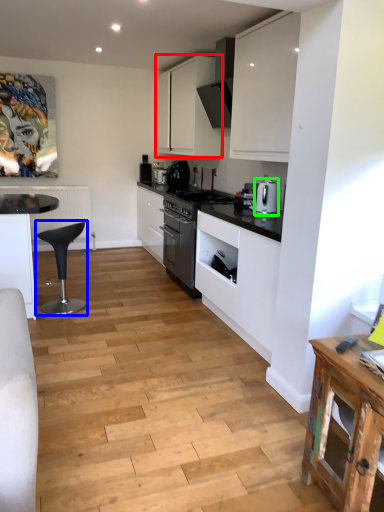
Question: Based on their relative distances, which object is farther from cabinetry (highlighted by a red box)? Choose from bar stool (highlighted by a blue box) and kitchen appliance (highlighted by a green box).

Choices:
 (A) bar stool
 (B) kitchen appliance

Answer: (A)